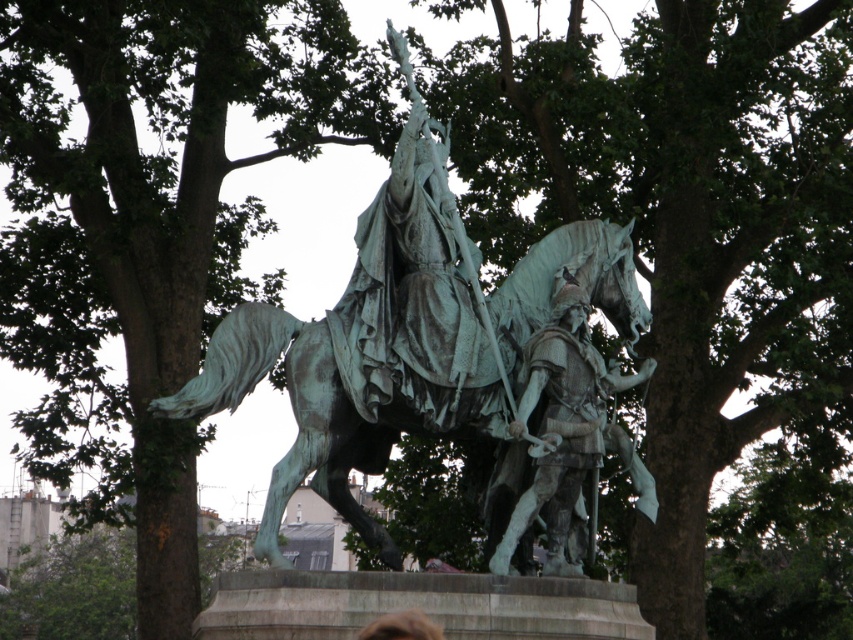
From the picture: You are a park visitor standing in front of the green patina statue at center and the bronze armor at center. Which object is positioned to the right side?

The bronze armor at center is positioned to the right of the green patina statue at center.